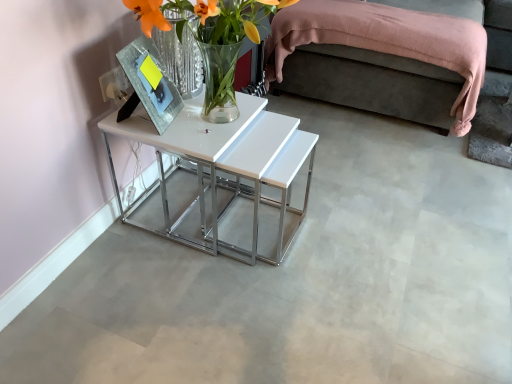
Image resolution: width=512 pixels, height=384 pixels. Identify the location of free spot below white glossy table at center (from a real-world perspective). (212, 206).